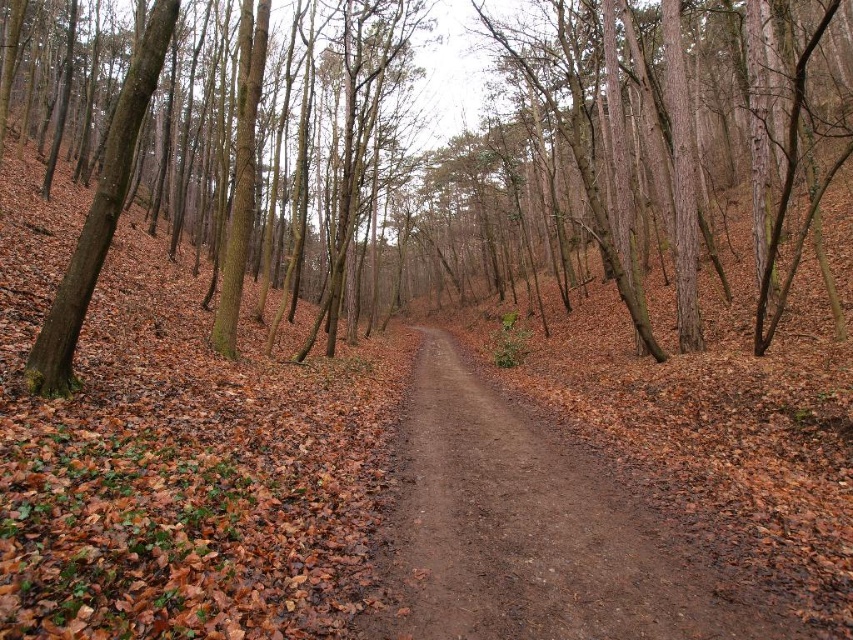
Can you confirm if brown bark tree at center is wider than brown dirt trail at center?

Yes.

Between brown bark tree at center and brown dirt trail at center, which one is positioned lower?

brown dirt trail at center is lower down.

Find the location of a particular element. This screenshot has width=853, height=640. brown bark tree at center is located at coordinates (471, 156).

Can you confirm if brown dirt trail at center is positioned above brown rough tree at left?

Incorrect, brown dirt trail at center is not positioned above brown rough tree at left.

Does brown dirt trail at center have a lesser height compared to brown rough tree at left?

Yes, brown dirt trail at center is shorter than brown rough tree at left.

What do you see at coordinates (531, 531) in the screenshot?
I see `brown dirt trail at center` at bounding box center [531, 531].

Locate an element on the screen. brown dirt trail at center is located at coordinates click(x=531, y=531).

You are a GUI agent. You are given a task and a screenshot of the screen. Output one action in this format:
    pyautogui.click(x=<x>, y=<y>)
    Task: Click on the brown bark tree at center
    Image resolution: width=853 pixels, height=640 pixels.
    Given the screenshot: What is the action you would take?
    pyautogui.click(x=471, y=156)

Does brown bark tree at center appear on the left side of brown rough tree at left?

In fact, brown bark tree at center is to the right of brown rough tree at left.

What are the coordinates of `brown bark tree at center` in the screenshot? It's located at (471, 156).